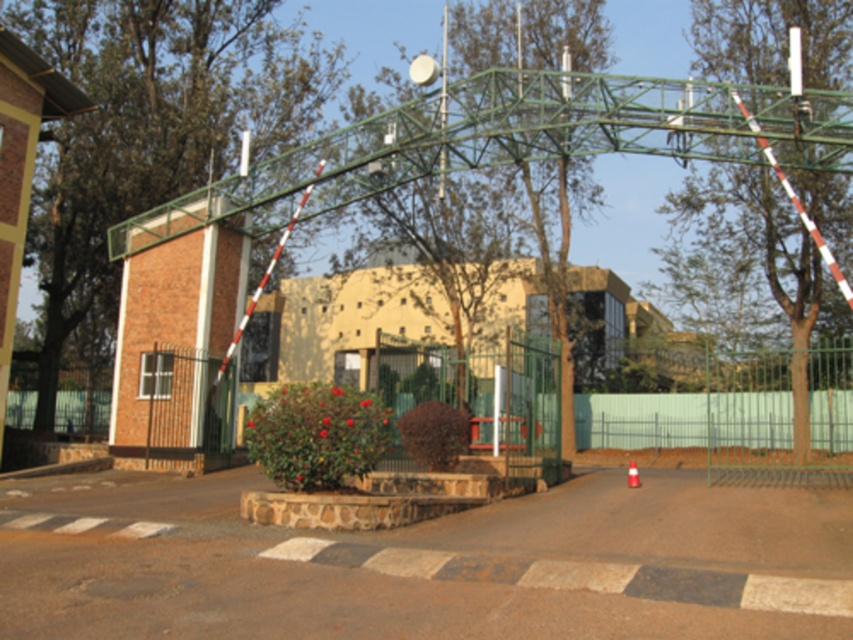
You are standing at the entrance of the building and want to reach the green metal fence at right. According to the scene description, where should you head towards?

The green metal fence at right is located at point (x=780, y=413), so you should head towards the right side of the image to reach it.

You are a delivery person trying to navigate through the fenced areas in the image. You need to pass through the green metal fence at right and the metallic fence at center. Which fence should you go through first if you want to take the shortest path?

The metallic fence at center is smaller in size than the green metal fence at right, so the metallic fence at center would require a shorter path to navigate around or through, making it the better choice for the shortest path.

You are a delivery person with a cart that is 2 meters wide. You need to move your cart through the gap between the green metal fence at right and the metallic fence at center. Can your cart fit through the gap?

The gap between the green metal fence at right and the metallic fence at center is 2.31 meters. Since your cart is 2 meters wide, it can fit through the gap as the width of the gap is greater than the cart.